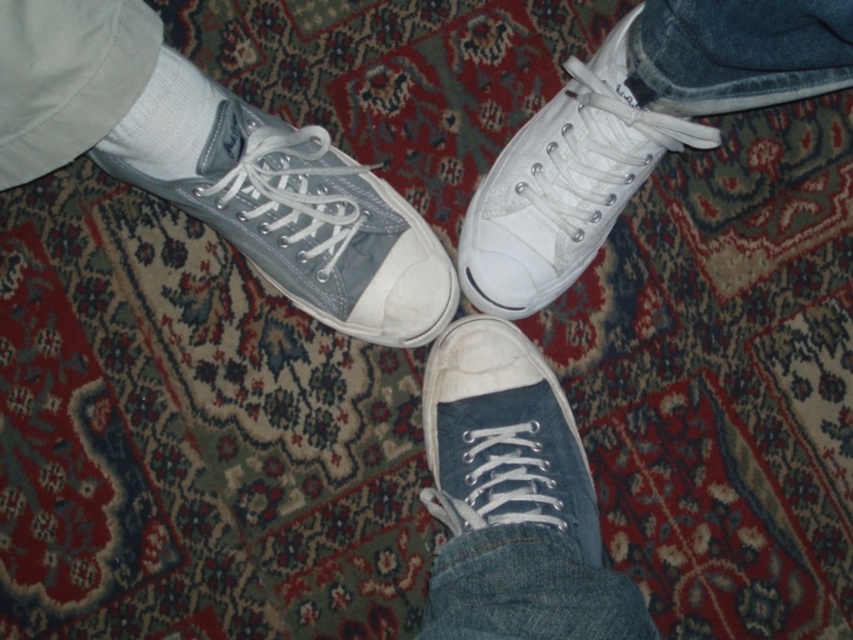
Can you confirm if gray canvas shoe at left is shorter than white cotton sock at upper left?

In fact, gray canvas shoe at left may be taller than white cotton sock at upper left.

You are a GUI agent. You are given a task and a screenshot of the screen. Output one action in this format:
    pyautogui.click(x=<x>, y=<y>)
    Task: Click on the gray canvas shoe at left
    
    Given the screenshot: What is the action you would take?
    pyautogui.click(x=300, y=218)

Between point (299, 228) and point (181, 156), which one is positioned in front?

Point (181, 156) is more forward.

Where is `gray canvas shoe at left`? The image size is (853, 640). gray canvas shoe at left is located at coordinates (300, 218).

Is white canvas shoe at lower center further to the viewer compared to white cotton sock at upper left?

Yes.

The image size is (853, 640). Describe the element at coordinates (502, 436) in the screenshot. I see `white canvas shoe at lower center` at that location.

At what (x,y) coordinates should I click in order to perform the action: click on white canvas shoe at lower center. Please return your answer as a coordinate pair (x, y). This screenshot has width=853, height=640. Looking at the image, I should click on (502, 436).

Is gray canvas shoe at left further to the viewer compared to white canvas shoe at upper right?

No, gray canvas shoe at left is in front of white canvas shoe at upper right.

Who is lower down, gray canvas shoe at left or white canvas shoe at upper right?

Positioned lower is gray canvas shoe at left.

Measure the distance between point [292,205] and camera.

The distance of point [292,205] from camera is 3.99 feet.

Locate an element on the screen. This screenshot has width=853, height=640. gray canvas shoe at left is located at coordinates (300, 218).